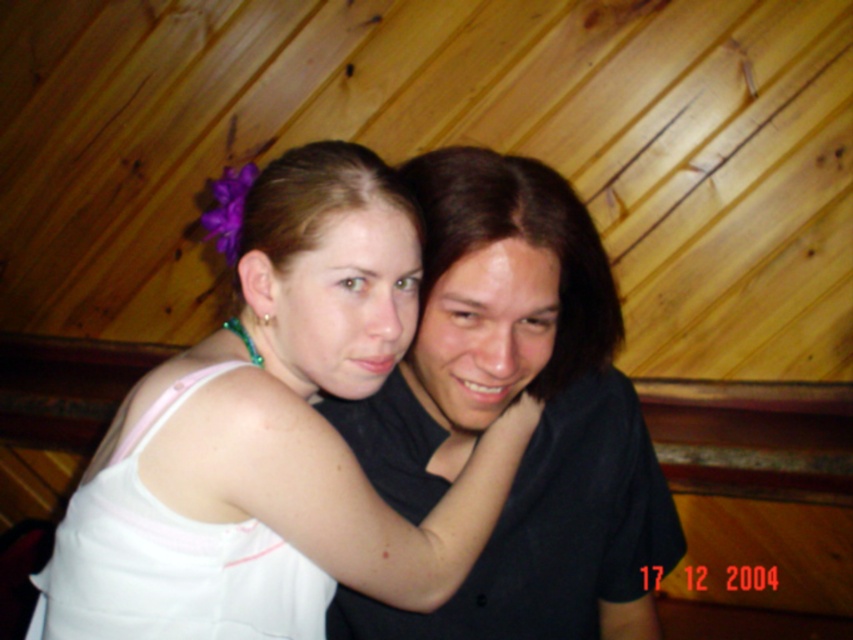
You are standing at point [236,406] and want to take a photo of the scene with your phone camera. The phone camera has a minimum focusing distance of 12 inches. Can you take a clear photo without moving closer?

The distance between point [236,406] and the camera is 28.67 inches, which is greater than the minimum focusing distance of 12 inches. Therefore, you can take a clear photo without moving closer.

You are a photographer setting up for a portrait. You have a 4.5 inch wide prop that needs to fit between the white fabric at center and the black matte shirt at center. Can the prop fit in the space between them?

The distance between the white fabric at center and the black matte shirt at center is 5.00 inches. Since the prop is 4.5 inches wide, it can fit in the space between them.

In the scene shown: You are a photographer setting up a shoot in this scene. You need to place a small prop between the white fabric at center and the black matte shirt at center. Based on their positions, where should you place the prop so it sits between them?

The white fabric at center is below the black matte shirt at center, so placing the prop between them would require positioning it above the white fabric at center and below the black matte shirt at center.